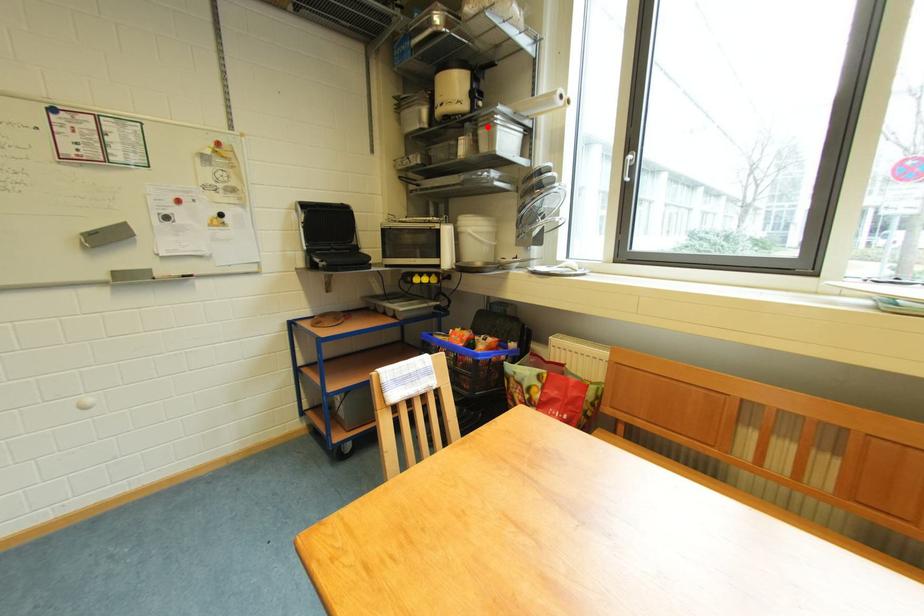
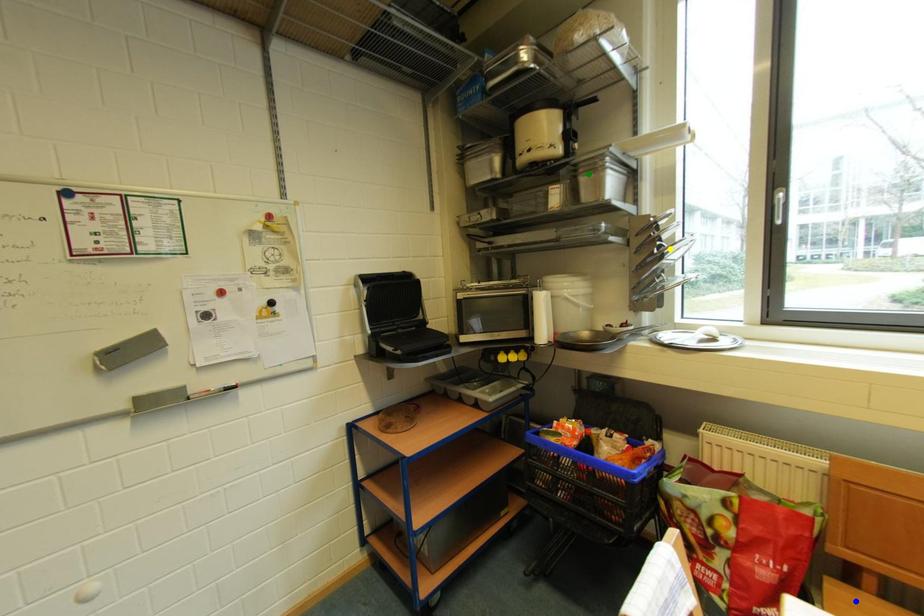
Question: I am providing you with two images of the same scene from different viewpoints. A red point is marked on the first image. You are given multiple points on the second image. Can you choose the point in image 2 that corresponds to the point in image 1?

Choices:
 (A) yellow point
 (B) blue point
 (C) green point

Answer: (C)